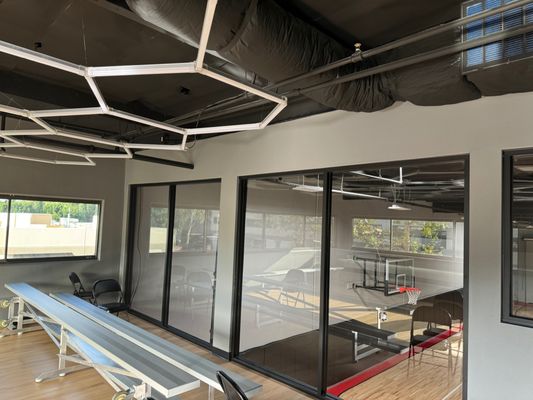
The width and height of the screenshot is (533, 400). In order to click on black chair in this screenshot , I will do `click(118, 303)`.